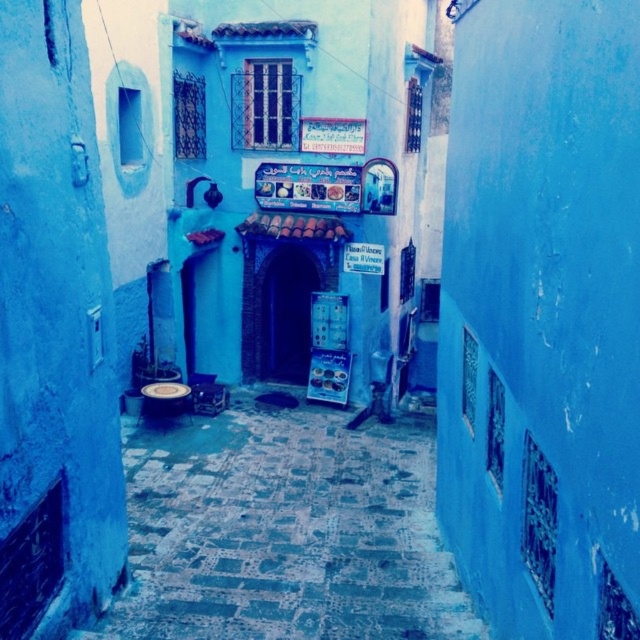
Question: Does smooth cobblestone alley at center appear over wooden stool at center?

Choices:
 (A) yes
 (B) no

Answer: (B)

Question: Is smooth cobblestone alley at center bigger than wooden stool at center?

Choices:
 (A) yes
 (B) no

Answer: (B)

Question: Does smooth cobblestone alley at center appear over wooden stool at center?

Choices:
 (A) no
 (B) yes

Answer: (A)

Question: Which of the following is the farthest from the observer?

Choices:
 (A) (296, 435)
 (B) (205, 412)

Answer: (B)